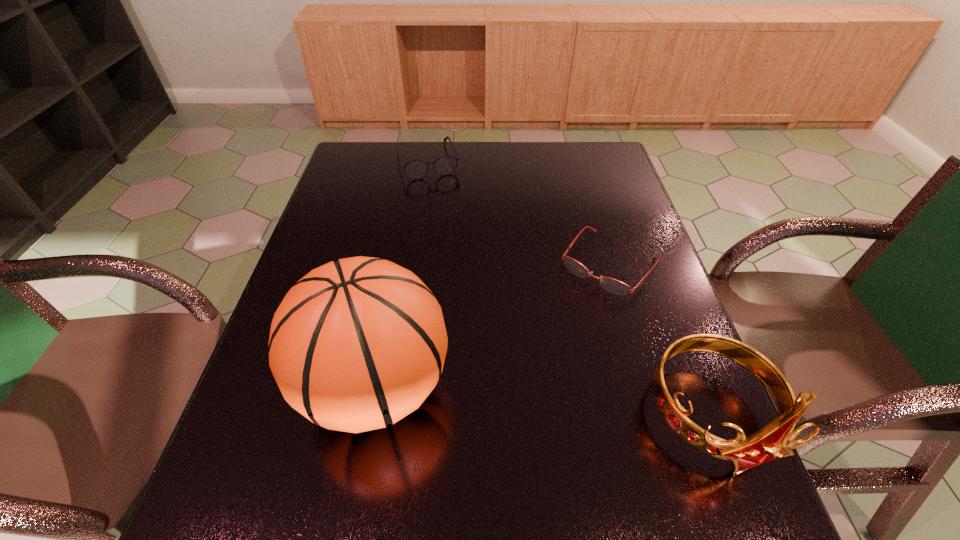
I want to click on basketball, so click(356, 344).

At what (x,y) coordinates should I click in order to perform the action: click on tiara. Please return your answer as a coordinate pair (x, y). Looking at the image, I should click on (775, 440).

At what (x,y) coordinates should I click in order to perform the action: click on the third nearest object. Please return your answer as a coordinate pair (x, y). Looking at the image, I should click on (612, 285).

At what (x,y) coordinates should I click in order to perform the action: click on the shorter spectacles. Please return your answer as a coordinate pair (x, y). The image size is (960, 540). Looking at the image, I should click on (612, 285).

The height and width of the screenshot is (540, 960). I want to click on the taller spectacles, so click(x=417, y=169).

The height and width of the screenshot is (540, 960). In order to click on the farther spectacles in this screenshot , I will do `click(417, 169)`.

At what (x,y) coordinates should I click in order to perform the action: click on free location located on the right of the basketball. Please return your answer as a coordinate pair (x, y). Looking at the image, I should click on (581, 387).

The image size is (960, 540). Identify the location of free space located on the lenses of the right spectacles. (561, 323).

The image size is (960, 540). What are the coordinates of `vacant space located on the lenses of the right spectacles` in the screenshot? It's located at (565, 318).

Locate an element on the screen. This screenshot has width=960, height=540. vacant space located 0.050m on the lenses of the right spectacles is located at coordinates (576, 305).